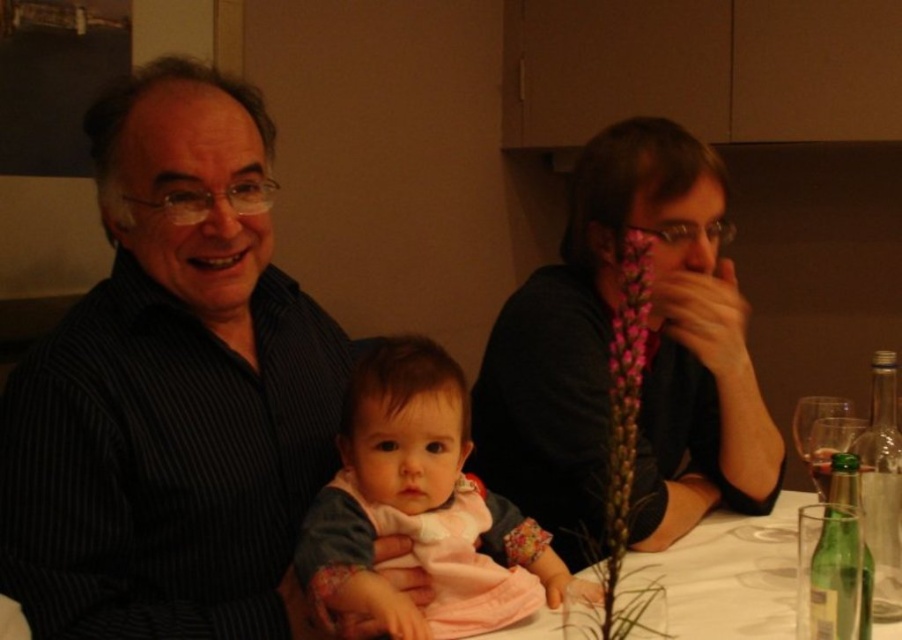
Is dark striped shirt at left in front of pink fabric baby at center?

Yes, dark striped shirt at left is closer to the viewer.

From the picture: Does dark striped shirt at left have a smaller size compared to pink fabric baby at center?

Actually, dark striped shirt at left might be larger than pink fabric baby at center.

What do you see at coordinates (171, 388) in the screenshot?
I see `dark striped shirt at left` at bounding box center [171, 388].

Where is `dark striped shirt at left`? dark striped shirt at left is located at coordinates (171, 388).

Is dark striped shirt at left positioned at the back of clear glass wine glass at right?

No, it is in front of clear glass wine glass at right.

Is point (256, 333) positioned behind point (827, 461)?

No, it is in front of (827, 461).

The image size is (902, 640). In order to click on dark striped shirt at left in this screenshot , I will do `click(171, 388)`.

Does pink fabric baby at center appear on the left side of transparent glass at upper right?

Correct, you'll find pink fabric baby at center to the left of transparent glass at upper right.

Is point (472, 538) more distant than point (850, 401)?

No.

Locate an element on the screen. The height and width of the screenshot is (640, 902). pink fabric baby at center is located at coordinates (420, 508).